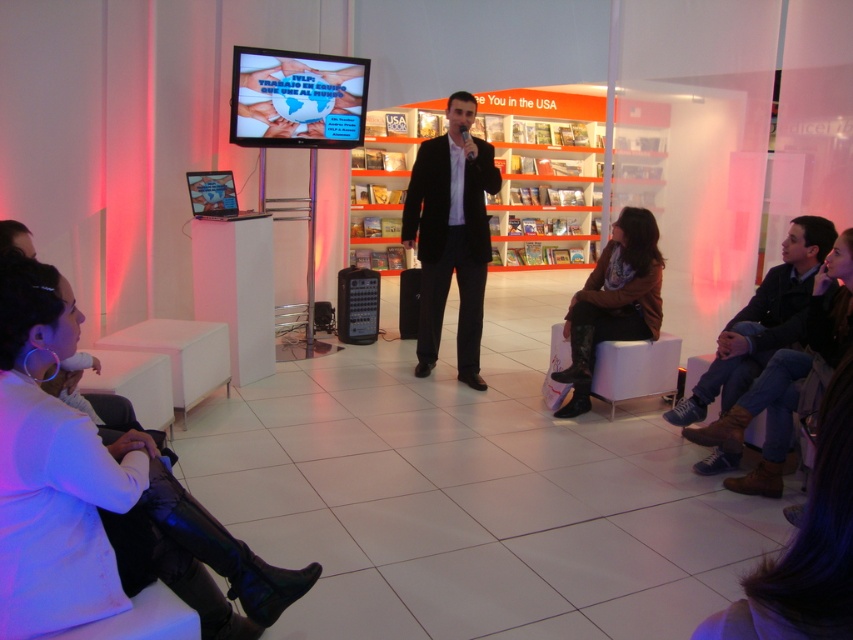
Question: Which point is closer to the camera taking this photo?

Choices:
 (A) (706, 376)
 (B) (624, 301)

Answer: (A)

Question: Does brown leather jacket at center have a lesser width compared to white fabric chair at lower center?

Choices:
 (A) yes
 (B) no

Answer: (A)

Question: Can you confirm if matte black suit at center is positioned to the right of dark blue jeans at lower right?

Choices:
 (A) yes
 (B) no

Answer: (B)

Question: Among these objects, which one is farthest from the camera?

Choices:
 (A) brown leather jacket at center
 (B) white fabric chair at lower center

Answer: (A)

Question: Estimate the real-world distances between objects in this image. Which object is farther from the white fabric chair at lower center?

Choices:
 (A) dark blue jeans at lower right
 (B) black matte speaker at center

Answer: (B)

Question: Can you confirm if matte black suit at center is positioned to the left of white fabric chair at lower center?

Choices:
 (A) yes
 (B) no

Answer: (A)